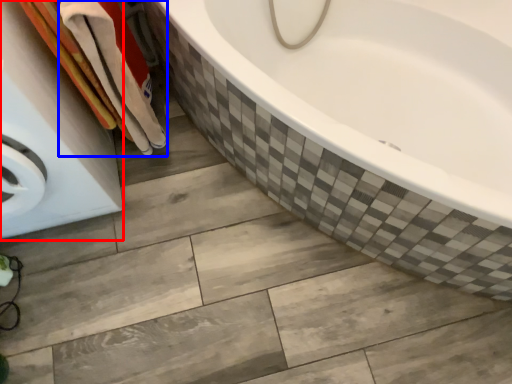
Question: Among these objects, which one is farthest to the camera, washing machine (highlighted by a red box) or bath towel (highlighted by a blue box)?

Choices:
 (A) washing machine
 (B) bath towel

Answer: (B)